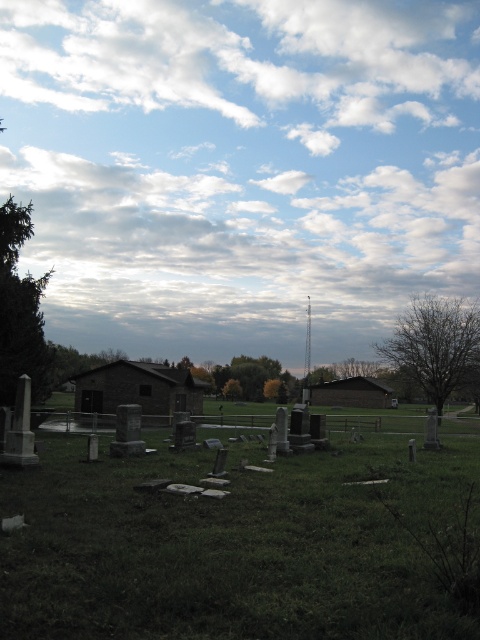
Is cloudy sky at upper center positioned at the back of green textured tree at left?

That is True.

You are a GUI agent. You are given a task and a screenshot of the screen. Output one action in this format:
    pyautogui.click(x=<x>, y=<y>)
    Task: Click on the cloudy sky at upper center
    The height and width of the screenshot is (640, 480).
    Given the screenshot: What is the action you would take?
    pyautogui.click(x=241, y=166)

Between point (243, 156) and point (36, 278), which one is positioned in front?

Point (36, 278) is in front.

I want to click on cloudy sky at upper center, so click(241, 166).

Can you confirm if cloudy sky at upper center is smaller than bare branches at right?

No, cloudy sky at upper center is not smaller than bare branches at right.

The width and height of the screenshot is (480, 640). Find the location of `cloudy sky at upper center`. cloudy sky at upper center is located at coordinates (241, 166).

Is point (47, 308) behind point (478, 323)?

Yes, point (47, 308) is farther from viewer.

Find the location of a particular element. This screenshot has height=640, width=480. cloudy sky at upper center is located at coordinates point(241,166).

Who is shorter, green grassy at lower center or green textured tree at left?

With less height is green grassy at lower center.

Between green grassy at lower center and green textured tree at left, which one has more height?

With more height is green textured tree at left.

I want to click on green grassy at lower center, so click(240, 545).